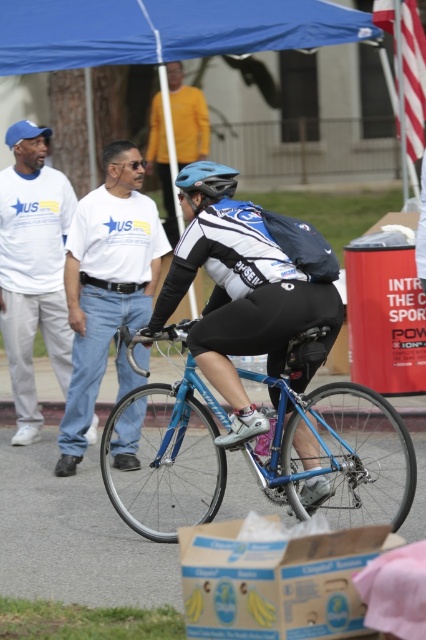
Is shiny blue bicycle at center further to the viewer compared to matte yellow shirt at upper center?

No, it is not.

Between point (209, 310) and point (184, 147), which one is positioned in front?

Positioned in front is point (209, 310).

Locate an element on the screen. This screenshot has height=640, width=426. shiny blue bicycle at center is located at coordinates (241, 305).

Is cardboard box with bananas at lower center to the right of matte yellow shirt at upper center from the viewer's perspective?

Indeed, cardboard box with bananas at lower center is positioned on the right side of matte yellow shirt at upper center.

Is point (215, 593) more distant than point (198, 141)?

No, (215, 593) is closer to viewer.

Locate an element on the screen. The image size is (426, 640). cardboard box with bananas at lower center is located at coordinates 275,582.

Does white cotton shirt at left appear on the right side of matte yellow shirt at upper center?

In fact, white cotton shirt at left is to the left of matte yellow shirt at upper center.

Consider the image. Measure the distance between white cotton shirt at left and camera.

A distance of 7.53 meters exists between white cotton shirt at left and camera.

What are the coordinates of `white cotton shirt at left` in the screenshot? It's located at (32, 269).